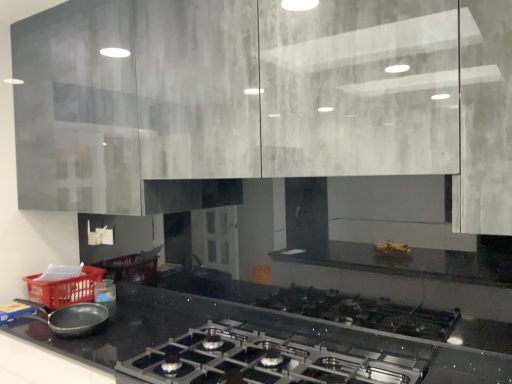
Question: Based on their sizes in the image, would you say matte black frying pan at lower left is bigger or smaller than matte gray cabinets at upper center?

Choices:
 (A) big
 (B) small

Answer: (B)

Question: From a real-world perspective, is matte black frying pan at lower left above or below matte gray cabinets at upper center?

Choices:
 (A) above
 (B) below

Answer: (B)

Question: Which of these objects is positioned closest to the matte gray cabinets at upper center?

Choices:
 (A) matte black frying pan at lower left
 (B) red plastic basket at lower left
 (C) satin black gas stove at lower center

Answer: (C)

Question: Which object is positioned farthest from the red plastic basket at lower left?

Choices:
 (A) matte black frying pan at lower left
 (B) matte gray cabinets at upper center
 (C) satin black gas stove at lower center

Answer: (B)